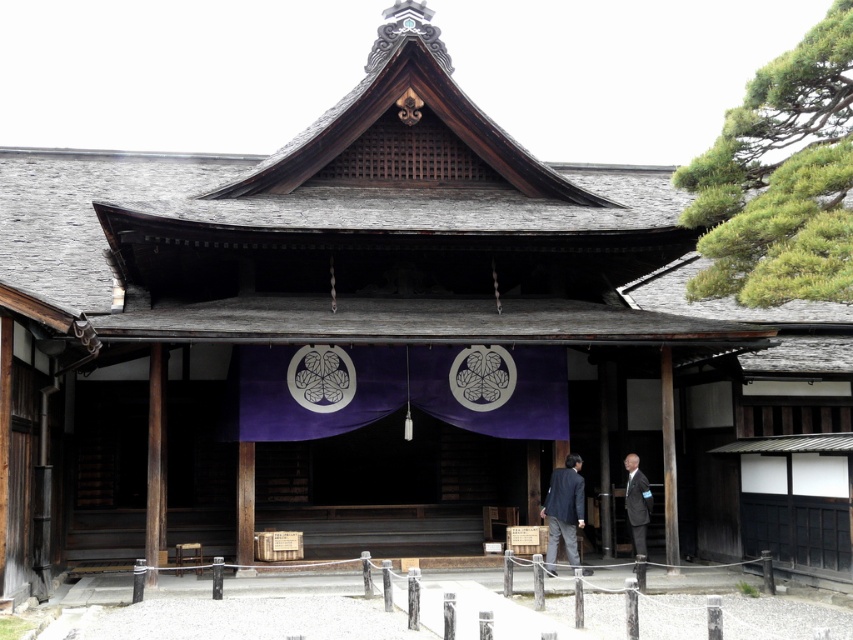
Question: Is brown wooden pillar at center positioned before dark gray suit at center?

Choices:
 (A) yes
 (B) no

Answer: (A)

Question: In this image, where is dark blue suit at center located relative to dark gray suit at center?

Choices:
 (A) above
 (B) below

Answer: (B)

Question: Which object is closer to the camera taking this photo?

Choices:
 (A) brown wooden pillar at center
 (B) dark gray suit at center

Answer: (A)

Question: Which object appears closest to the camera in this image?

Choices:
 (A) brown wooden pillar at center
 (B) dark gray suit at center

Answer: (A)

Question: Can you confirm if dark blue suit at center is bigger than brown wooden pillar at center?

Choices:
 (A) no
 (B) yes

Answer: (B)

Question: Which point is closer to the camera taking this photo?

Choices:
 (A) (582, 484)
 (B) (660, 403)
 (C) (628, 509)

Answer: (A)